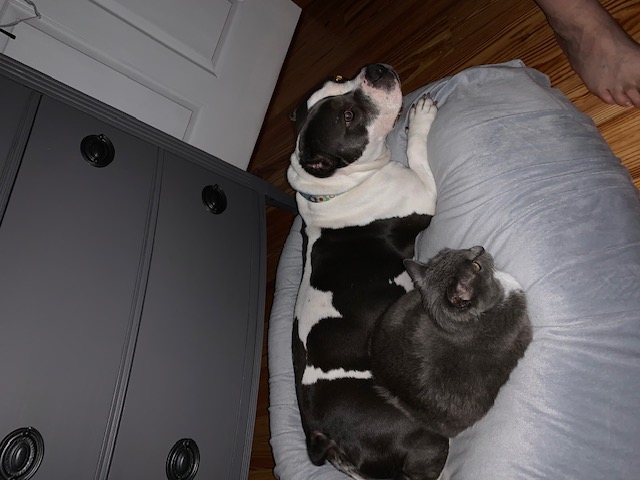
You are a GUI agent. You are given a task and a screenshot of the screen. Output one action in this format:
    pyautogui.click(x=<x>, y=<y>)
    Task: Click on the floor
    The height and width of the screenshot is (480, 640).
    Given the screenshot: What is the action you would take?
    pyautogui.click(x=614, y=312)